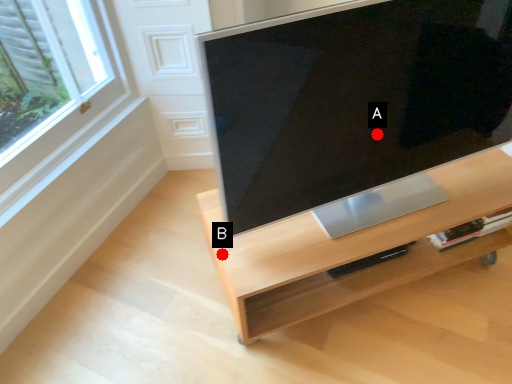
Question: Two points are circled on the image, labeled by A and B beside each circle. Among these points, which one is farthest from the camera?

Choices:
 (A) A is further
 (B) B is further

Answer: (B)